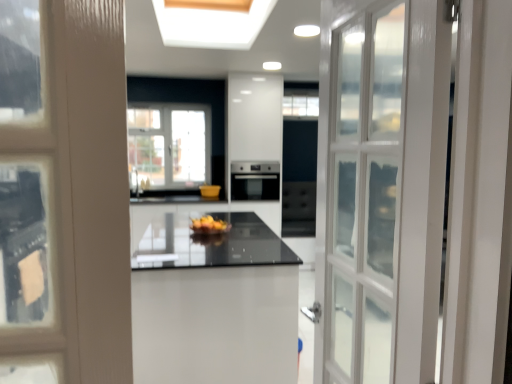
The image size is (512, 384). What are the coordinates of `satin black oven at center` in the screenshot? It's located at (255, 180).

The height and width of the screenshot is (384, 512). What do you see at coordinates (211, 301) in the screenshot?
I see `white glossy table at center` at bounding box center [211, 301].

Identify the location of satin black oven at center. (255, 180).

How much distance is there between satin black oven at center and yellow matte bowl at center?

satin black oven at center and yellow matte bowl at center are 1.64 meters apart.

In terms of width, does satin black oven at center look wider or thinner when compared to yellow matte bowl at center?

In the image, satin black oven at center appears to be wider than yellow matte bowl at center.

From the image's perspective, would you say satin black oven at center is positioned over yellow matte bowl at center?

Yes, from the image's perspective, satin black oven at center is above yellow matte bowl at center.

Is satin black oven at center at the right side of yellow matte bowl at center?

Correct, you'll find satin black oven at center to the right of yellow matte bowl at center.

What are the coordinates of `fruit located on the left of satin black oven at center` in the screenshot? It's located at (209, 225).

Is yellow matte bowl at center inside the boundaries of satin black oven at center, or outside?

yellow matte bowl at center cannot be found inside satin black oven at center.

How many degrees apart are the facing directions of yellow matte bowl at center and satin black oven at center?

94.5 degrees separate the facing orientations of yellow matte bowl at center and satin black oven at center.

From the picture: Is the position of yellow matte bowl at center less distant than that of satin black oven at center?

Yes, yellow matte bowl at center is in front of satin black oven at center.

From the image's perspective, is satin black oven at center above white glossy table at center?

Yes, from the image's perspective, satin black oven at center is over white glossy table at center.

Does point (252, 186) appear closer or farther from the camera than point (147, 312)?

Point (252, 186) appears to be farther away from the viewer than point (147, 312).

Between satin black oven at center and white glossy table at center, which one has smaller size?

satin black oven at center is smaller.

How different are the orientations of satin black oven at center and white glossy table at center in degrees?

91.4 degrees.

Is white glossy table at center positioned beyond the bounds of satin black oven at center?

Indeed, white glossy table at center is completely outside satin black oven at center.

Is the depth of white glossy table at center greater than that of satin black oven at center?

No, it is not.

Is point (145, 323) positioned in front of point (258, 196)?

Yes, point (145, 323) is in front of point (258, 196).

Is white glossy table at center at the left side of satin black oven at center?

Yes.

Does white glossy table at center touch yellow matte bowl at center?

No, white glossy table at center is not beside yellow matte bowl at center.

From the image's perspective, is white glossy table at center on yellow matte bowl at center?

No, from the image's perspective, white glossy table at center is not above yellow matte bowl at center.

Would you say white glossy table at center is inside or outside yellow matte bowl at center?

white glossy table at center exists outside the volume of yellow matte bowl at center.

Is the depth of white glossy table at center greater than that of yellow matte bowl at center?

No.

Is yellow matte bowl at center at the right side of white glossy table at center?

Yes.

Is yellow matte bowl at center aimed at white glossy table at center?

No, yellow matte bowl at center does not turn towards white glossy table at center.

Is yellow matte bowl at center shorter than white glossy table at center?

Yes.

Identify the location of fruit that appears below the satin black oven at center (from a real-world perspective). (209, 225).

Find the location of a particular element. The image size is (512, 384). appliance above the yellow matte bowl at center (from the image's perspective) is located at coordinates (255, 180).

Looking at the image, which one is located further to satin black oven at center, white glossy table at center or yellow matte bowl at center?

The object further to satin black oven at center is white glossy table at center.

Considering their positions, is yellow matte bowl at center positioned closer to white glossy table at center than satin black oven at center?

Among the two, yellow matte bowl at center is located nearer to white glossy table at center.

From the picture: Looking at the image, which one is located further to satin black oven at center, yellow matte bowl at center or white glossy table at center?

Based on the image, white glossy table at center appears to be further to satin black oven at center.

Based on their spatial positions, is satin black oven at center or white glossy table at center further from yellow matte bowl at center?

satin black oven at center is positioned further to the anchor yellow matte bowl at center.

Based on their spatial positions, is satin black oven at center or yellow matte bowl at center closer to white glossy table at center?

yellow matte bowl at center is closer to white glossy table at center.

Estimate the real-world distances between objects in this image. Which object is further from yellow matte bowl at center, white glossy table at center or satin black oven at center?

satin black oven at center.

Locate an element on the screen. The image size is (512, 384). fruit between white glossy table at center and satin black oven at center in the front-back direction is located at coordinates (209, 225).